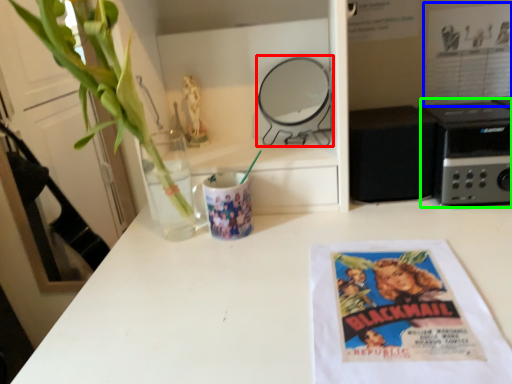
Question: Which is farther away from appliance (highlighted by a red box)? movie poster (highlighted by a blue box) or appliance (highlighted by a green box)?

Choices:
 (A) movie poster
 (B) appliance

Answer: (A)